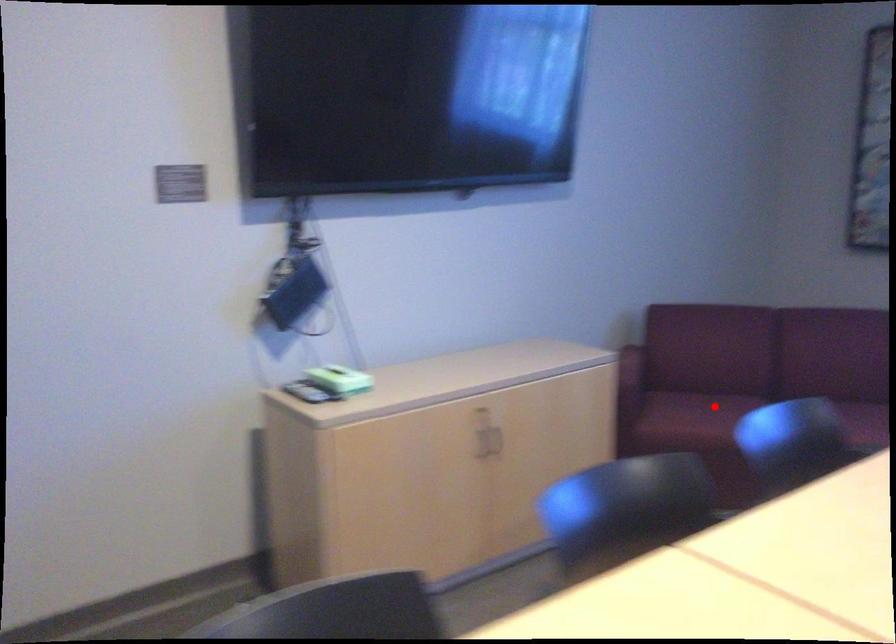
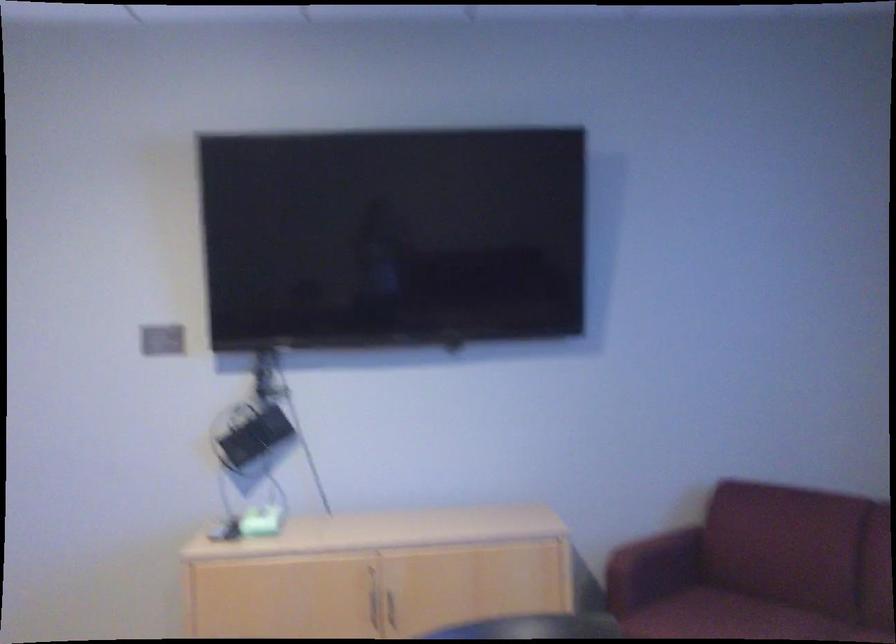
Question: I am providing you with two images of the same scene from different viewpoints. A red point is shown in image1. For the corresponding object point in image2, is it positioned nearer or farther from the camera?

Choices:
 (A) Nearer
 (B) Farther

Answer: (A)